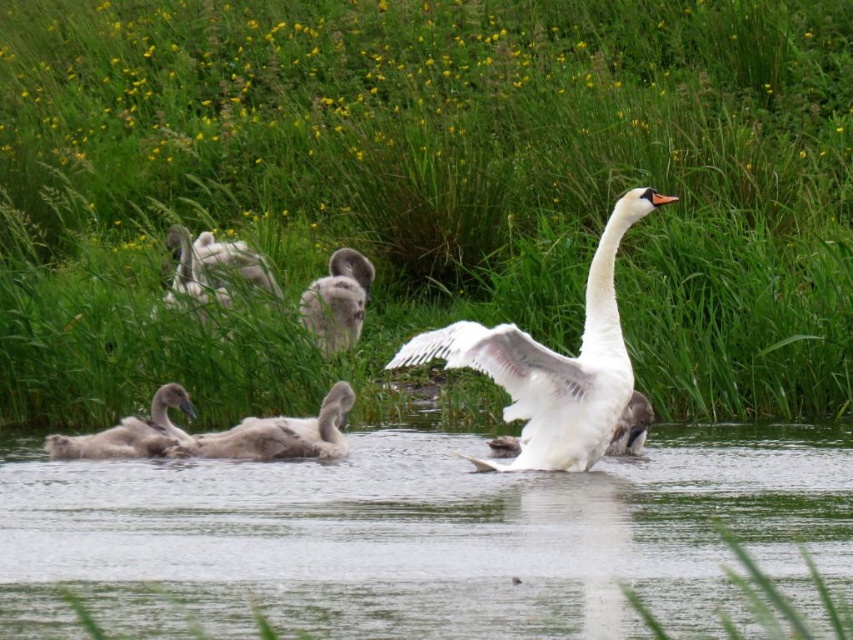
Question: Can you confirm if gray downy duckling at upper left is bigger than gray downy gosling at lower left?

Choices:
 (A) no
 (B) yes

Answer: (B)

Question: Does gray downy gosling at center come in front of gray downy duckling at upper left?

Choices:
 (A) yes
 (B) no

Answer: (A)

Question: Which object appears farthest from the camera in this image?

Choices:
 (A) gray downy gosling at center
 (B) gray downy duckling at center

Answer: (B)

Question: Is clear water at center further to camera compared to gray downy duckling at upper left?

Choices:
 (A) yes
 (B) no

Answer: (B)

Question: Which point is farther from the camera taking this photo?

Choices:
 (A) (341, 317)
 (B) (554, 474)
 (C) (257, 435)
 (D) (161, 445)

Answer: (A)

Question: Among these objects, which one is farthest from the camera?

Choices:
 (A) gray downy gosling at lower left
 (B) white matte duck at center
 (C) gray downy duckling at upper left

Answer: (C)